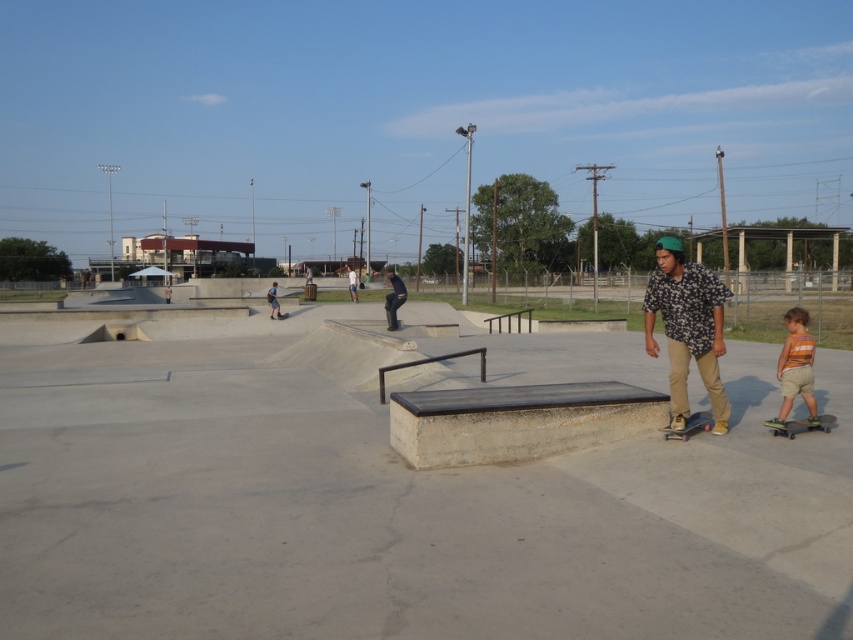
Who is shorter, striped cotton shirt at lower right or black rubber skateboard at center?

black rubber skateboard at center

Does striped cotton shirt at lower right appear on the left side of black rubber skateboard at center?

No, striped cotton shirt at lower right is not to the left of black rubber skateboard at center.

This screenshot has height=640, width=853. In order to click on striped cotton shirt at lower right in this screenshot , I will do `click(795, 369)`.

You are a GUI agent. You are given a task and a screenshot of the screen. Output one action in this format:
    pyautogui.click(x=<x>, y=<y>)
    Task: Click on the striped cotton shirt at lower right
    Image resolution: width=853 pixels, height=640 pixels.
    Given the screenshot: What is the action you would take?
    pyautogui.click(x=795, y=369)

This screenshot has height=640, width=853. What do you see at coordinates (801, 426) in the screenshot? I see `green rubber skateboard at lower right` at bounding box center [801, 426].

This screenshot has width=853, height=640. Describe the element at coordinates (801, 426) in the screenshot. I see `green rubber skateboard at lower right` at that location.

Locate an element on the screen. The width and height of the screenshot is (853, 640). green rubber skateboard at lower right is located at coordinates (801, 426).

How distant is green rubber skateboard at lower right from black rubber skateboard at center?

green rubber skateboard at lower right is 68.50 feet away from black rubber skateboard at center.

At what (x,y) coordinates should I click in order to perform the action: click on green rubber skateboard at lower right. Please return your answer as a coordinate pair (x, y). Looking at the image, I should click on (801, 426).